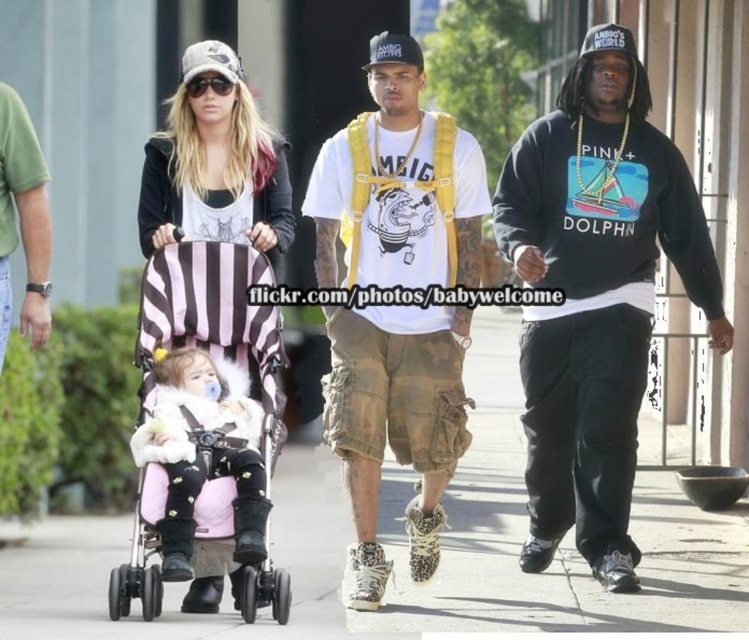
Question: Which object appears farthest from the camera in this image?

Choices:
 (A) zebra-patterned fabric stroller at center
 (B) matte black jacket at center

Answer: (B)

Question: Can you confirm if white cotton t-shirt at center is positioned to the right of fuzzy white coat at center?

Choices:
 (A) yes
 (B) no

Answer: (A)

Question: Which object appears farthest from the camera in this image?

Choices:
 (A) white cotton t-shirt at center
 (B) matte black jacket at center

Answer: (A)

Question: Which point appears farthest from the camera in this image?

Choices:
 (A) (568, 74)
 (B) (200, 248)
 (C) (342, 241)

Answer: (C)

Question: Is matte black jacket at center positioned in front of fuzzy white coat at center?

Choices:
 (A) no
 (B) yes

Answer: (A)

Question: Does black cotton sweatshirt at right appear on the left side of fuzzy white coat at center?

Choices:
 (A) no
 (B) yes

Answer: (A)